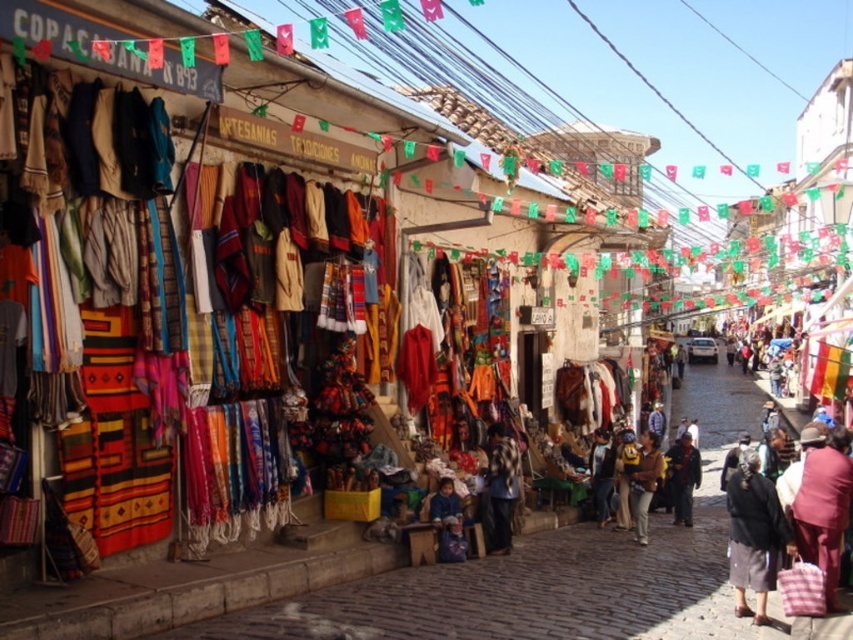
In the scene shown: Who is taller, pink fabric bag at lower right or brown leather jacket at center?

With more height is pink fabric bag at lower right.

Between point (824, 566) and point (630, 481), which one is positioned in front?

Point (824, 566) is in front.

This screenshot has width=853, height=640. In order to click on pink fabric bag at lower right in this screenshot , I will do `click(824, 508)`.

Where is `pink fabric bag at lower right`? Image resolution: width=853 pixels, height=640 pixels. pink fabric bag at lower right is located at coordinates (824, 508).

Which is above, dark brown fabric skirt at lower right or checkered fabric at center?

checkered fabric at center is higher up.

Does dark brown fabric skirt at lower right appear on the right side of checkered fabric at center?

Indeed, dark brown fabric skirt at lower right is positioned on the right side of checkered fabric at center.

Is point (762, 509) behind point (503, 468)?

No, (762, 509) is closer to viewer.

Find the location of `dark brown fabric skirt at lower right`. dark brown fabric skirt at lower right is located at coordinates (753, 536).

Is brown leather jacket at center wider than dark blue jacket at center?

No.

Is point (639, 467) positioned after point (685, 433)?

No.

I want to click on brown leather jacket at center, so click(643, 483).